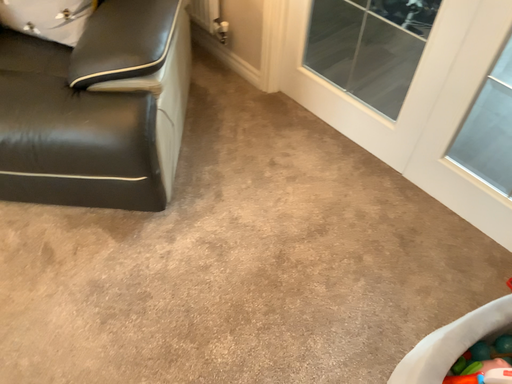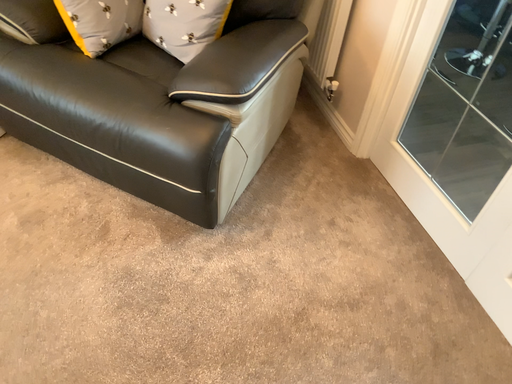
Question: Which way did the camera rotate in the video?

Choices:
 (A) rotated downward
 (B) rotated upward

Answer: (B)